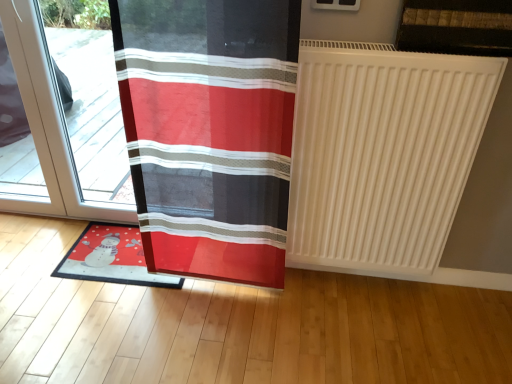
Question: Visually, is matte plastic mat at lower left positioned to the left or to the right of white matte radiator at right?

Choices:
 (A) left
 (B) right

Answer: (A)

Question: Is matte plastic mat at lower left bigger or smaller than white matte radiator at right?

Choices:
 (A) big
 (B) small

Answer: (B)

Question: Which object is the closest to the matte plastic mat at lower left?

Choices:
 (A) transparent glass door at left
 (B) white matte radiator at right
 (C) red fabric curtain at left

Answer: (A)

Question: Which object is positioned farthest from the transparent glass door at left?

Choices:
 (A) matte plastic mat at lower left
 (B) red fabric curtain at left
 (C) white matte radiator at right

Answer: (C)